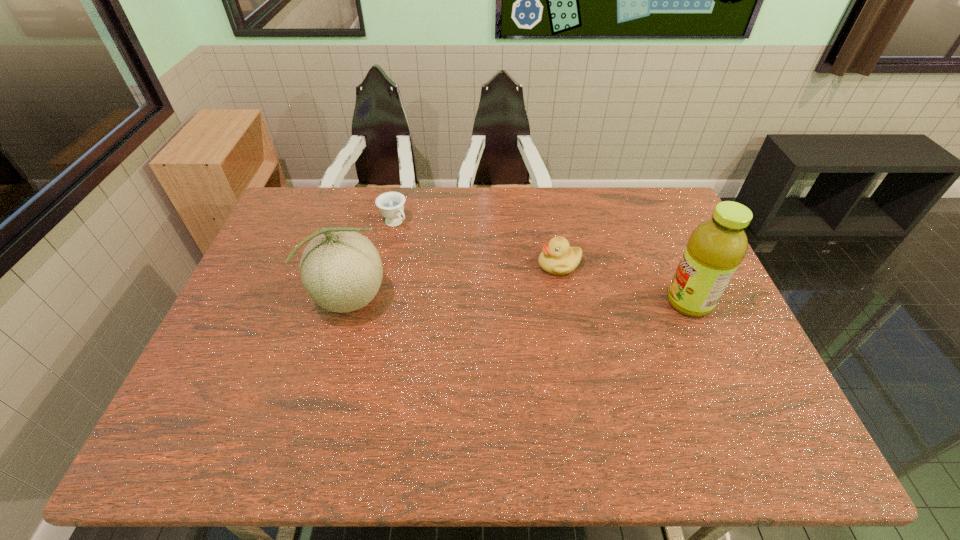
Identify the location of vacant position located on the side of the shortest object with the handle. (425, 251).

This screenshot has height=540, width=960. I want to click on free space located on the side of the shortest object with the handle, so click(x=480, y=301).

Locate an element on the screen. free space located on the side of the shortest object with the handle is located at coordinates (440, 265).

The image size is (960, 540). What are the coordinates of `vacant position located on the beak of the duckling` in the screenshot? It's located at (483, 307).

This screenshot has height=540, width=960. I want to click on vacant space located 0.290m on the beak of the duckling, so click(463, 319).

Identify the location of free space located on the beak of the duckling. Image resolution: width=960 pixels, height=540 pixels. (483, 307).

At what (x,y) coordinates should I click in order to perform the action: click on object that is at the far edge. Please return your answer as a coordinate pair (x, y). Image resolution: width=960 pixels, height=540 pixels. Looking at the image, I should click on (391, 204).

Locate an element on the screen. object located in the right edge section of the desktop is located at coordinates (716, 247).

This screenshot has height=540, width=960. I want to click on free space at the far edge, so coord(613,188).

Where is `vacant point at the near edge`? The image size is (960, 540). vacant point at the near edge is located at coordinates (396, 387).